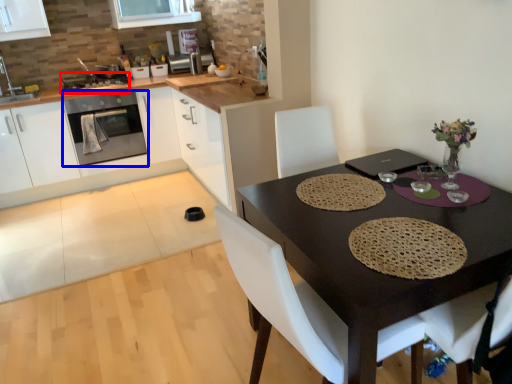
Question: Among these objects, which one is nearest to the camera, appliance (highlighted by a red box) or kitchen appliance (highlighted by a blue box)?

Choices:
 (A) appliance
 (B) kitchen appliance

Answer: (B)